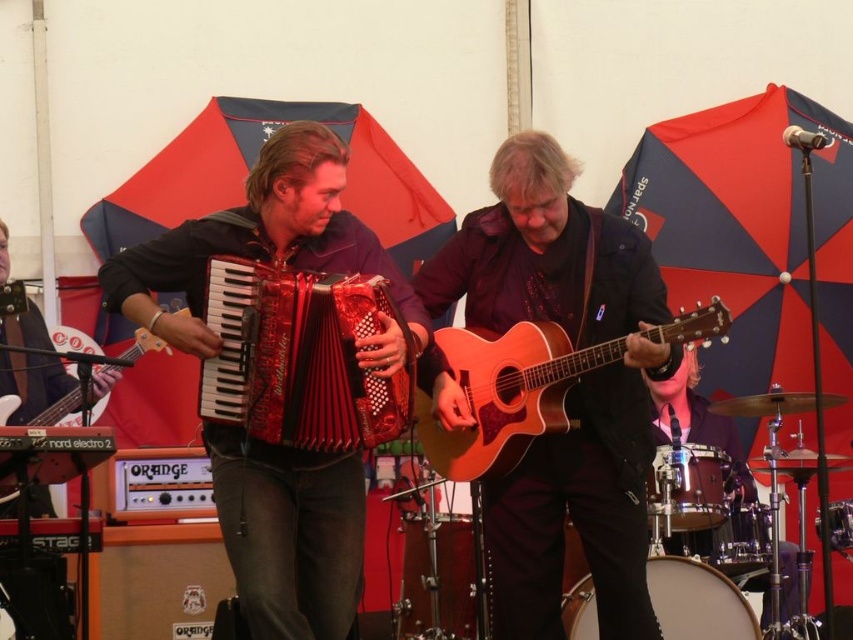
You are a photographer standing at the origin point of the coordinate system. You want to take a photo of the brown leather guitar at center. What are the coordinates where you should aim your camera?

The brown leather guitar at center is located at coordinates point (567, 390), so you should aim your camera at those coordinates to capture it.

You are a photographer setting up for a live music session. You need to position your camera such that both the red shiny accordion at center and the matte black guitar at center are in frame. Considering their sizes, which instrument should you ensure is closer to the camera to maintain a balanced composition?

The red shiny accordion at center is much taller than the matte black guitar at center. To maintain a balanced composition, position the taller red shiny accordion at center slightly farther from the camera and the shorter matte black guitar at center closer, so their apparent sizes in the photo are more even.

From the picture: You are a stagehand setting up a storage case that can only fit one instrument. You need to decide which instrument between the red shiny accordion at center and the matte black guitar at center will fit. Which one should you choose?

The matte black guitar at center should be chosen because the red shiny accordion at center is bigger and would not fit in the storage case designed for one instrument.